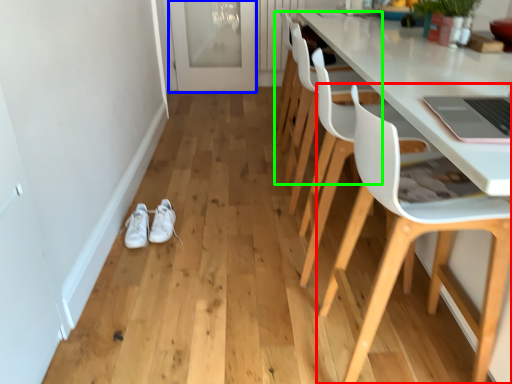
Question: Which object is the closest to the chair (highlighted by a red box)? Choose among these: glass door (highlighted by a blue box) or chair (highlighted by a green box).

Choices:
 (A) glass door
 (B) chair

Answer: (B)